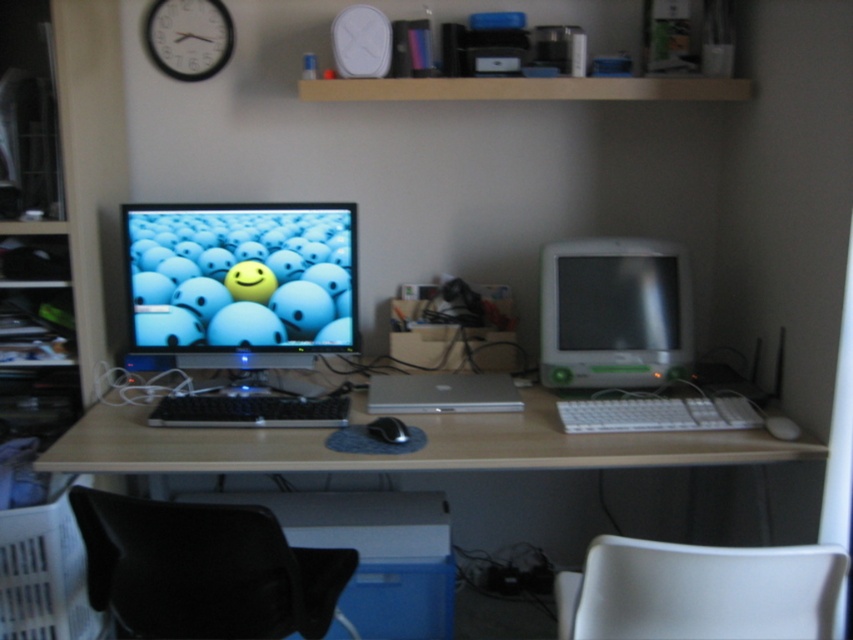
Can you confirm if black leather swivel chair at lower left is smaller than white plastic swivel chair at lower right?

Actually, black leather swivel chair at lower left might be larger than white plastic swivel chair at lower right.

Is point (265, 625) farther from viewer compared to point (564, 579)?

No, it is in front of (564, 579).

Find the location of a particular element. Image resolution: width=853 pixels, height=640 pixels. black leather swivel chair at lower left is located at coordinates (204, 570).

This screenshot has width=853, height=640. Identify the location of white plastic swivel chair at lower right. (699, 592).

Is the position of white plastic swivel chair at lower right less distant than that of white plastic monitor at right?

Yes, white plastic swivel chair at lower right is closer to the viewer.

Which is behind, point (766, 547) or point (680, 284)?

The point (680, 284) is more distant.

The width and height of the screenshot is (853, 640). What are the coordinates of `white plastic swivel chair at lower right` in the screenshot? It's located at (699, 592).

Between matte plastic monitor at center and white plastic keyboard at center, which one has more height?

Standing taller between the two is matte plastic monitor at center.

Locate an element on the screen. matte plastic monitor at center is located at coordinates click(x=241, y=282).